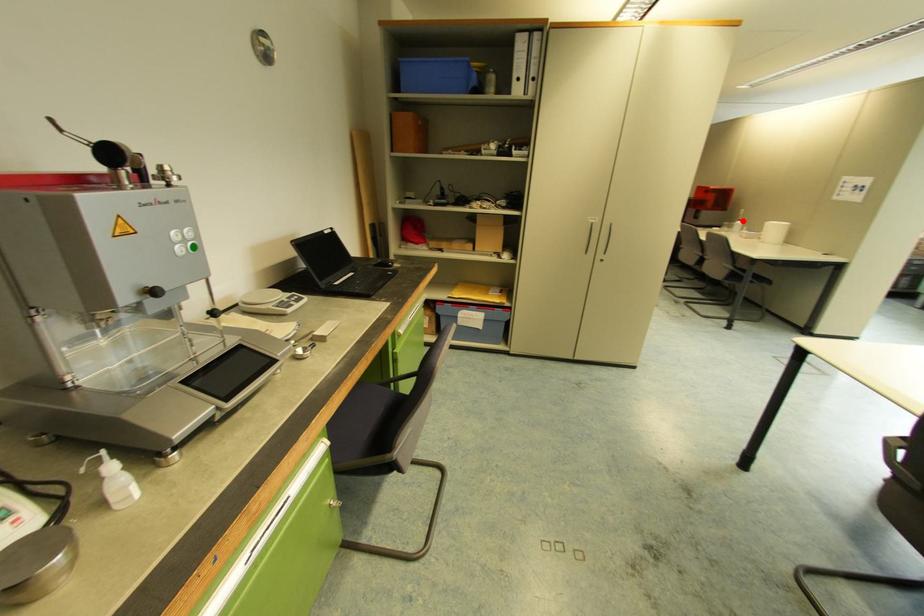
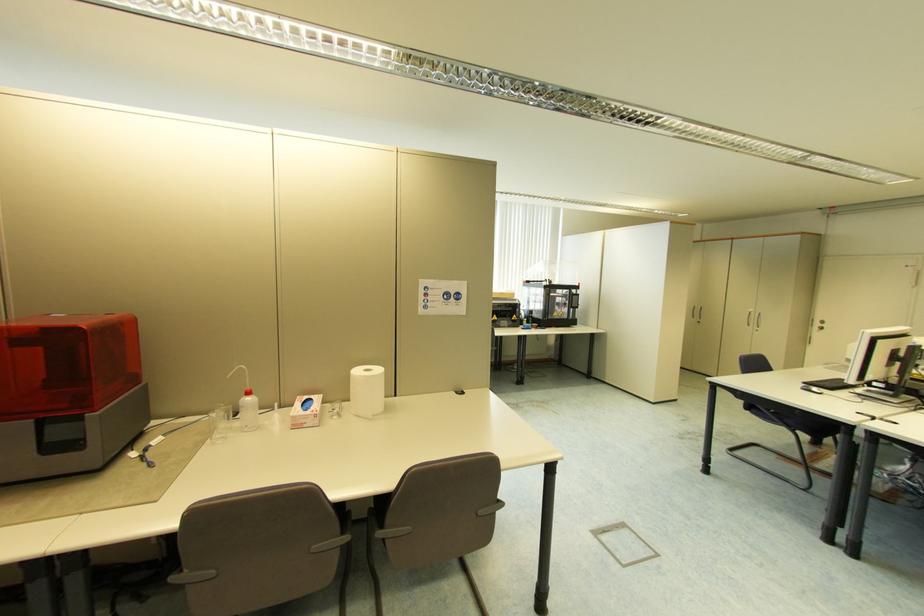
Find the pixel in the second image that matches the highlighted location in the first image.

(252, 392)